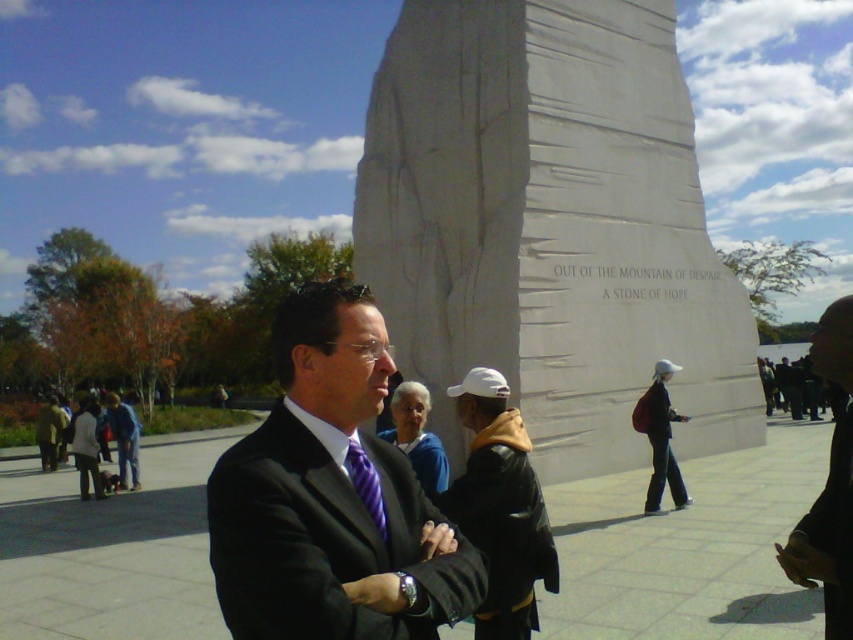
Does point (331, 378) come closer to viewer compared to point (848, 426)?

Yes, it is.

Describe the element at coordinates (329, 497) in the screenshot. I see `black suit at center` at that location.

Where is `black suit at center`? The image size is (853, 640). black suit at center is located at coordinates (329, 497).

Does blue denim jacket at left have a lesser width compared to purple striped tie at center?

In fact, blue denim jacket at left might be wider than purple striped tie at center.

Between point (120, 401) and point (357, 456), which one is positioned behind?

Positioned behind is point (120, 401).

What are the coordinates of `blue denim jacket at left` in the screenshot? It's located at (125, 438).

Is white stone monument at center above white matte baseball cap at center?

Indeed, white stone monument at center is positioned over white matte baseball cap at center.

Does white stone monument at center have a lesser height compared to white matte baseball cap at center?

Incorrect, white stone monument at center's height does not fall short of white matte baseball cap at center's.

Find the location of a particular element. The image size is (853, 640). white stone monument at center is located at coordinates (550, 227).